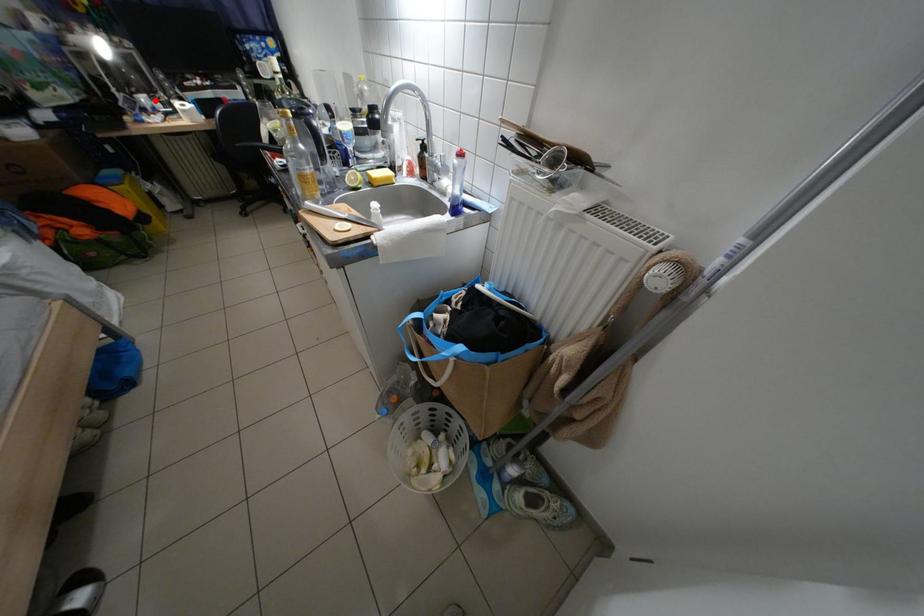
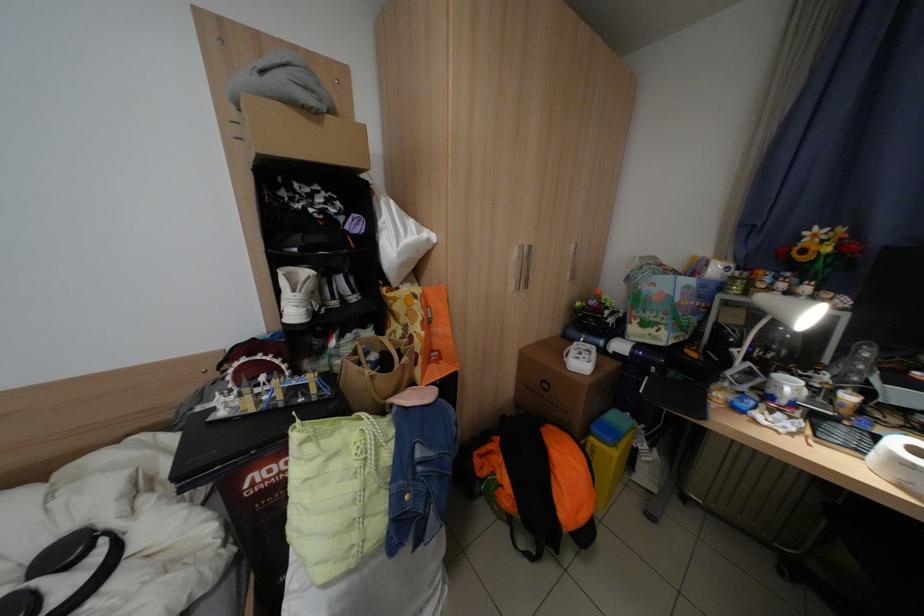
Question: I am providing you with two images of the same scene from different viewpoints. Given a red point in image1, look at the same physical point in image2. Is it:

Choices:
 (A) Closer to the viewpoint
 (B) Farther from the viewpoint

Answer: (A)